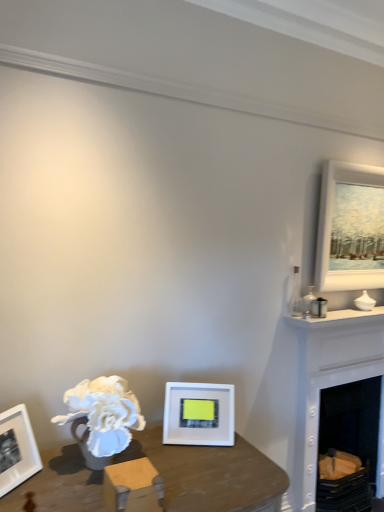
Question: In terms of width, does white painted wood fireplace at right look wider or thinner when compared to white matte picture frame at lower center, the 2th picture frame viewed from the back?

Choices:
 (A) wide
 (B) thin

Answer: (A)

Question: Does point (319, 346) appear closer or farther from the camera than point (215, 442)?

Choices:
 (A) farther
 (B) closer

Answer: (A)

Question: Estimate the real-world distances between objects in this image. Which object is farther from the white painted wood fireplace at right?

Choices:
 (A) white matte picture frame at upper right, which ranks as the 1th picture frame in top-to-bottom order
 (B) white matte picture frame at lower center, placed as the 1th picture frame when sorted from left to right

Answer: (B)

Question: Which of these objects is positioned closest to the white matte picture frame at lower center, placed as the 1th picture frame when sorted from left to right?

Choices:
 (A) white matte picture frame at upper right, the 2th picture frame when ordered from bottom to top
 (B) white painted wood fireplace at right

Answer: (B)